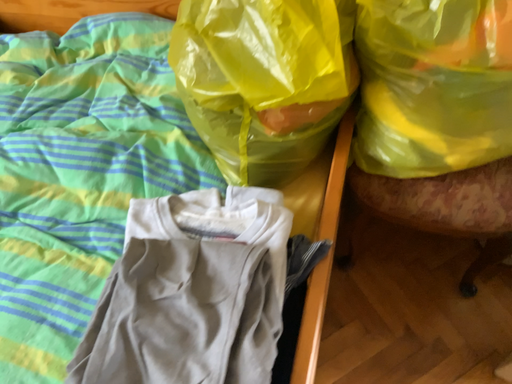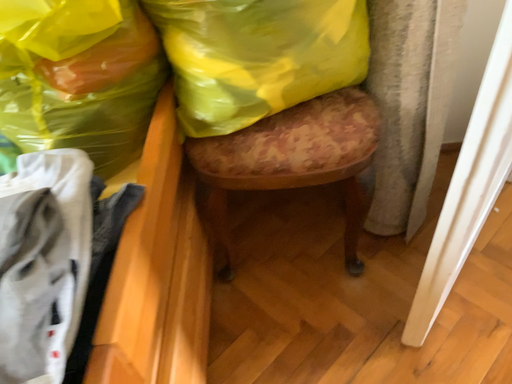
Question: Which way did the camera rotate in the video?

Choices:
 (A) rotated downward
 (B) rotated upward

Answer: (B)